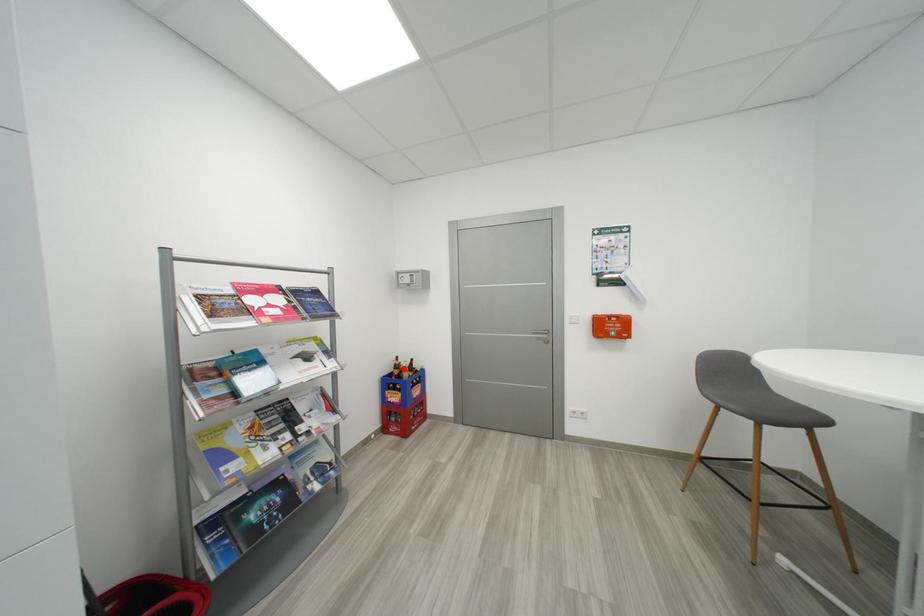
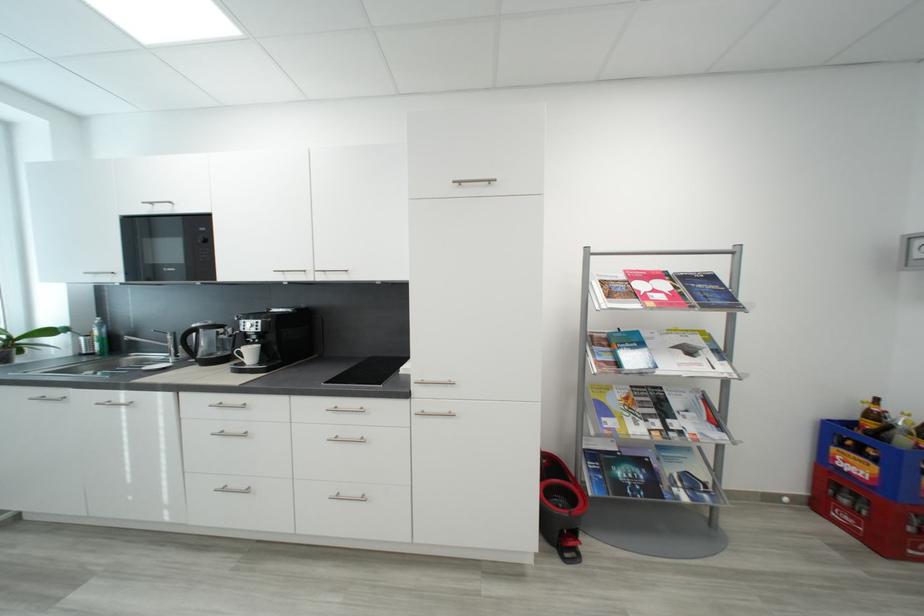
Locate, in the second image, the point that corresponds to the highlighted location in the first image.

(881, 418)